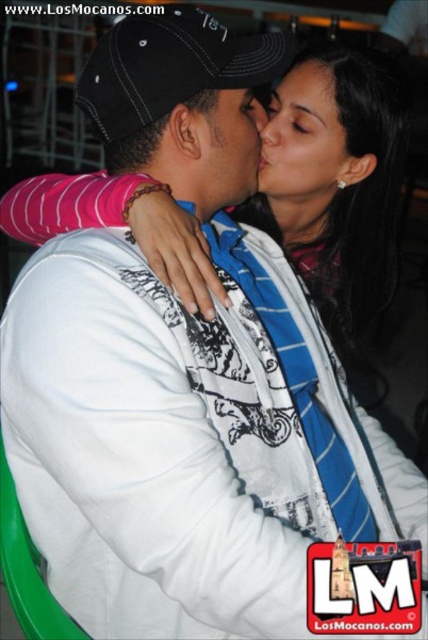
Consider the image. Is smooth skin face at center smaller than matte black cap at center?

Incorrect, smooth skin face at center is not smaller in size than matte black cap at center.

Does point (281, 104) lie in front of point (225, 131)?

No, (281, 104) is behind (225, 131).

Which is behind, point (329, 104) or point (225, 202)?

The point (329, 104) is behind.

Where is `smooth skin face at center`? The width and height of the screenshot is (428, 640). smooth skin face at center is located at coordinates (303, 138).

Who is higher up, smooth skin face at center or smooth skin forehead at upper center?

Positioned higher is smooth skin forehead at upper center.

Does smooth skin face at center have a larger size compared to smooth skin forehead at upper center?

Indeed, smooth skin face at center has a larger size compared to smooth skin forehead at upper center.

Which is in front, point (285, 124) or point (309, 68)?

Point (285, 124)

Identify the location of smooth skin face at center. (303, 138).

Between matte black cap at center and smooth skin forehead at upper center, which one is positioned higher?

smooth skin forehead at upper center

Between point (261, 128) and point (291, 84), which one is positioned behind?

Point (291, 84)

Which is in front, point (204, 164) or point (326, 61)?

Positioned in front is point (204, 164).

Find the location of a particular element. This screenshot has width=428, height=640. matte black cap at center is located at coordinates (231, 145).